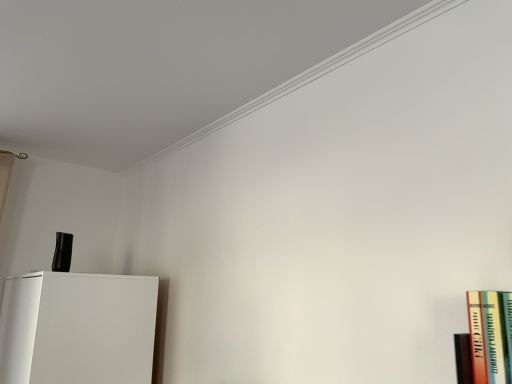
Find the location of a particular element. The image size is (512, 384). hardcover book at right is located at coordinates (487, 337).

What do you see at coordinates (487, 337) in the screenshot? I see `hardcover book at right` at bounding box center [487, 337].

Measure the distance between hardcover book at right and camera.

They are 73.85 centimeters apart.

What is the approximate height of white matte cabinet at lower left?

26.98 inches.

Where is `white matte cabinet at lower left`? The width and height of the screenshot is (512, 384). white matte cabinet at lower left is located at coordinates (78, 328).

Describe the element at coordinates (78, 328) in the screenshot. The image size is (512, 384). I see `white matte cabinet at lower left` at that location.

Where is `hardcover book at right`? The height and width of the screenshot is (384, 512). hardcover book at right is located at coordinates (487, 337).

Which object is positioned more to the right, hardcover book at right or white matte cabinet at lower left?

From the viewer's perspective, hardcover book at right appears more on the right side.

Is the depth of hardcover book at right greater than that of white matte cabinet at lower left?

No, it is in front of white matte cabinet at lower left.

Between point (490, 333) and point (122, 282), which one is positioned in front?

The point (490, 333) is closer to the camera.

From the image's perspective, between hardcover book at right and white matte cabinet at lower left, who is located below?

white matte cabinet at lower left is shown below in the image.

From a real-world perspective, who is located higher, hardcover book at right or white matte cabinet at lower left?

From a 3D spatial view, hardcover book at right is above.

Is hardcover book at right wider or thinner than white matte cabinet at lower left?

hardcover book at right is thinner than white matte cabinet at lower left.

Between hardcover book at right and white matte cabinet at lower left, which one has less height?

hardcover book at right.

Does hardcover book at right have a larger size compared to white matte cabinet at lower left?

No.

Would you say hardcover book at right contains white matte cabinet at lower left?

No, white matte cabinet at lower left is not inside hardcover book at right.

Would you consider hardcover book at right to be distant from white matte cabinet at lower left?

Yes, hardcover book at right and white matte cabinet at lower left are located far from each other.

Is hardcover book at right facing towards white matte cabinet at lower left?

No, hardcover book at right is not turned towards white matte cabinet at lower left.

There is a white matte cabinet at lower left. Identify the location of book above it (from a real-world perspective). This screenshot has width=512, height=384. (487, 337).

Which object is positioned more to the left, white matte cabinet at lower left or hardcover book at right?

white matte cabinet at lower left.

Which is in front, white matte cabinet at lower left or hardcover book at right?

hardcover book at right.

Is point (55, 282) in front of point (472, 304)?

No.

From the image's perspective, is white matte cabinet at lower left above hardcover book at right?

Incorrect, from the image's perspective, white matte cabinet at lower left is lower than hardcover book at right.

From a real-world perspective, is white matte cabinet at lower left on top of hardcover book at right?

Incorrect, from a real-world perspective, white matte cabinet at lower left is lower than hardcover book at right.

Is white matte cabinet at lower left thinner than hardcover book at right?

No, white matte cabinet at lower left is not thinner than hardcover book at right.

In the scene shown: Can you confirm if white matte cabinet at lower left is taller than hardcover book at right?

Indeed, white matte cabinet at lower left has a greater height compared to hardcover book at right.

Considering the sizes of objects white matte cabinet at lower left and hardcover book at right in the image provided, who is bigger, white matte cabinet at lower left or hardcover book at right?

white matte cabinet at lower left is bigger.

Is white matte cabinet at lower left inside or outside of hardcover book at right?

white matte cabinet at lower left is spatially situated outside hardcover book at right.

Are white matte cabinet at lower left and hardcover book at right located far from each other?

Yes.

Is white matte cabinet at lower left oriented away from hardcover book at right?

No, white matte cabinet at lower left's orientation is not away from hardcover book at right.

How distant is white matte cabinet at lower left from hardcover book at right?

1.75 meters.

I want to click on book that appears on the right of white matte cabinet at lower left, so click(487, 337).

This screenshot has width=512, height=384. I want to click on book in front of the white matte cabinet at lower left, so click(x=487, y=337).

Find the location of `furniture behind the hardcover book at right`. furniture behind the hardcover book at right is located at coordinates (78, 328).